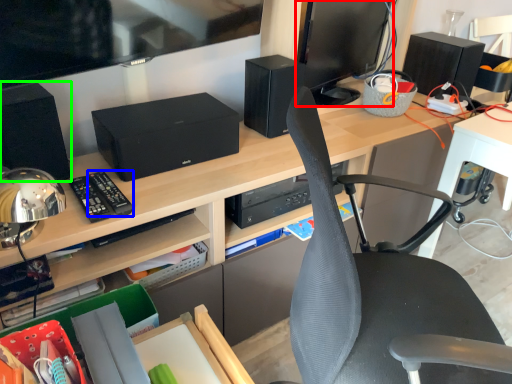
Question: Which is farther away from computer monitor (highlighted by a red box)? control (highlighted by a blue box) or speaker (highlighted by a green box)?

Choices:
 (A) control
 (B) speaker

Answer: (A)